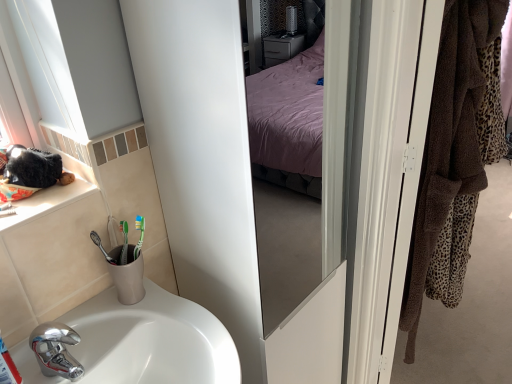
Question: Is white glossy screen door at right oriented towards white ceramic window sill at left?

Choices:
 (A) yes
 (B) no

Answer: (B)

Question: From the image's perspective, is white glossy screen door at right above white ceramic window sill at left?

Choices:
 (A) no
 (B) yes

Answer: (A)

Question: Can you confirm if white glossy screen door at right is shorter than white ceramic window sill at left?

Choices:
 (A) yes
 (B) no

Answer: (B)

Question: From a real-world perspective, is white glossy screen door at right physically below white ceramic window sill at left?

Choices:
 (A) no
 (B) yes

Answer: (B)

Question: Considering the relative positions of white glossy screen door at right and white ceramic window sill at left in the image provided, is white glossy screen door at right to the right of white ceramic window sill at left from the viewer's perspective?

Choices:
 (A) yes
 (B) no

Answer: (A)

Question: Does white glossy screen door at right have a smaller size compared to white ceramic window sill at left?

Choices:
 (A) no
 (B) yes

Answer: (A)

Question: Does white glossy sink at lower left have a lesser height compared to brown towel at right?

Choices:
 (A) no
 (B) yes

Answer: (B)

Question: Does white glossy sink at lower left contain brown towel at right?

Choices:
 (A) yes
 (B) no

Answer: (B)

Question: Considering the relative sizes of white glossy sink at lower left and brown towel at right in the image provided, is white glossy sink at lower left smaller than brown towel at right?

Choices:
 (A) no
 (B) yes

Answer: (B)

Question: Considering the relative positions of white glossy sink at lower left and brown towel at right in the image provided, is white glossy sink at lower left to the right of brown towel at right from the viewer's perspective?

Choices:
 (A) no
 (B) yes

Answer: (A)

Question: Considering the relative sizes of white glossy sink at lower left and brown towel at right in the image provided, is white glossy sink at lower left thinner than brown towel at right?

Choices:
 (A) no
 (B) yes

Answer: (B)

Question: Is white glossy sink at lower left taller than brown towel at right?

Choices:
 (A) no
 (B) yes

Answer: (A)

Question: Considering the relative sizes of brown towel at right and white glossy sink at lower left in the image provided, is brown towel at right smaller than white glossy sink at lower left?

Choices:
 (A) yes
 (B) no

Answer: (B)